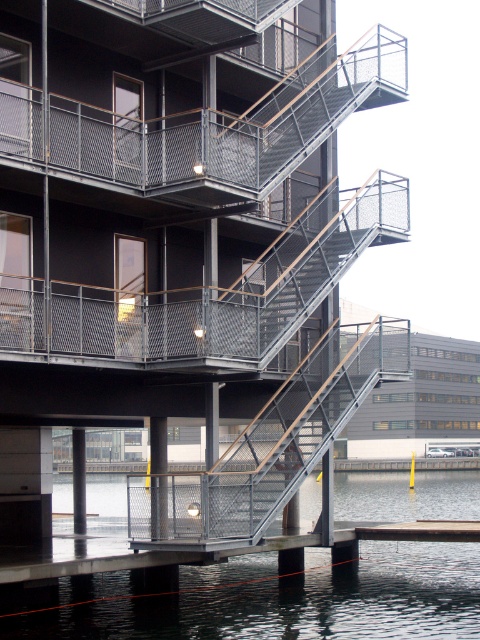
Is metallic gray water at lower center thinner than black mesh balcony at upper center?

No, metallic gray water at lower center is not thinner than black mesh balcony at upper center.

Is point (103, 630) positioned after point (142, 179)?

No, it is not.

This screenshot has height=640, width=480. Find the location of `metallic gray water at lower center`. metallic gray water at lower center is located at coordinates (280, 600).